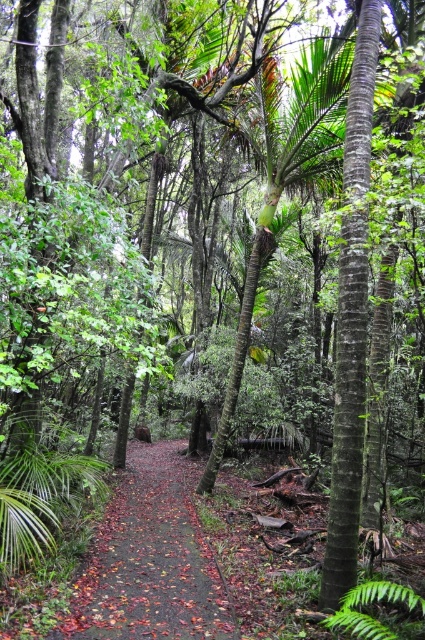
Consider the image. Which of these two, brown dirt path at center or green leafy fern at center, stands shorter?

brown dirt path at center

Between brown dirt path at center and green leafy fern at center, which one appears on the right side from the viewer's perspective?

green leafy fern at center is more to the right.

Who is more distant from viewer, (x=156, y=588) or (x=385, y=586)?

The point (x=156, y=588) is more distant.

Where is `brown dirt path at center`? brown dirt path at center is located at coordinates [150, 563].